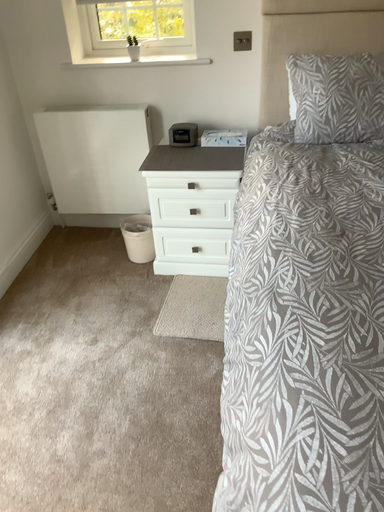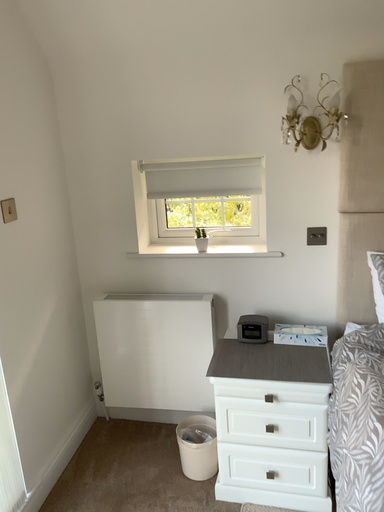
Question: Which way did the camera rotate in the video?

Choices:
 (A) rotated downward
 (B) rotated upward

Answer: (B)